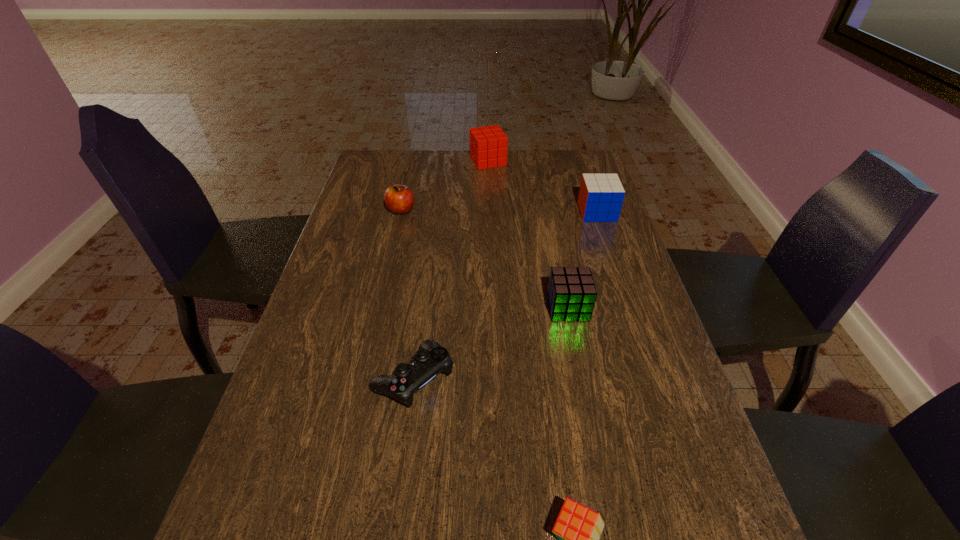
You are a GUI agent. You are given a task and a screenshot of the screen. Output one action in this format:
    pyautogui.click(x=<x>, y=<y>)
    Task: Click on the vacant point located between the farthest object and the rightmost object
    This screenshot has height=540, width=960.
    Given the screenshot: What is the action you would take?
    pyautogui.click(x=542, y=186)

I want to click on vacant space that is in between the fifth farthest object and the fourth farthest object, so click(491, 343).

What are the coordinates of `vacant point located between the third nearest cube and the third nearest object` in the screenshot? It's located at (583, 260).

Find the location of a particular element. The height and width of the screenshot is (540, 960). blank region between the second farthest cube and the third nearest object is located at coordinates (583, 260).

Locate an element on the screen. Image resolution: width=960 pixels, height=540 pixels. object identified as the fifth closest to the apple is located at coordinates (578, 528).

Find the location of a particular element. the fourth closest object to the apple is located at coordinates (600, 199).

Locate an element on the screen. the second closest cube to the third object from left to right is located at coordinates (571, 293).

Point out which cube is positioned as the fourth nearest to the apple. Please provide its 2D coordinates. Your answer should be formatted as a tuple, i.e. [(x, y)], where the tuple contains the x and y coordinates of a point satisfying the conditions above.

[(578, 528)]

Find the location of a particular element. vacant area that satisfies the following two spatial constraints: 1. on the front side of the leftmost cube; 2. on the right side of the second farthest cube is located at coordinates click(490, 212).

Find the location of a particular element. free space that satisfies the following two spatial constraints: 1. on the back side of the control; 2. on the right side of the second nearest cube is located at coordinates (422, 307).